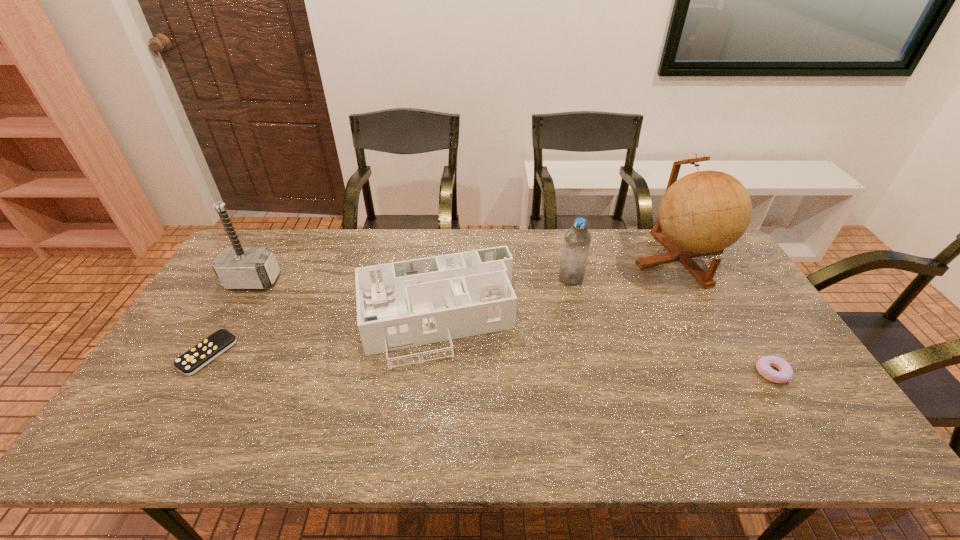
Locate an element on the screen. This screenshot has height=540, width=960. doughnut at the right edge is located at coordinates (763, 365).

At what (x,y) coordinates should I click in order to perform the action: click on object that is at the far left corner. Please return your answer as a coordinate pair (x, y). The width and height of the screenshot is (960, 540). Looking at the image, I should click on (237, 267).

The width and height of the screenshot is (960, 540). In order to click on object that is at the far right corner in this screenshot , I will do `click(704, 212)`.

You are a GUI agent. You are given a task and a screenshot of the screen. Output one action in this format:
    pyautogui.click(x=<x>, y=<y>)
    Task: Click on the free space at the far edge
    
    Given the screenshot: What is the action you would take?
    pyautogui.click(x=332, y=269)

In the image, there is a desktop. Find the location of `vacant space at the near edge`. vacant space at the near edge is located at coordinates (605, 446).

The width and height of the screenshot is (960, 540). Identify the location of free space at the left edge. (203, 325).

Find the location of a particular element. This screenshot has width=960, height=540. vacant space at the right edge of the desktop is located at coordinates tap(729, 290).

Locate an element on the screen. The height and width of the screenshot is (540, 960). vacant area that lies between the fourth object from left to right and the globe is located at coordinates (625, 268).

At what (x,y) coordinates should I click in order to perform the action: click on empty space that is in between the tallest object and the doughnut. Please return your answer as a coordinate pair (x, y). Looking at the image, I should click on (726, 315).

Locate an element on the screen. This screenshot has height=540, width=960. vacant space in between the fourth tallest object and the doughnut is located at coordinates (604, 345).